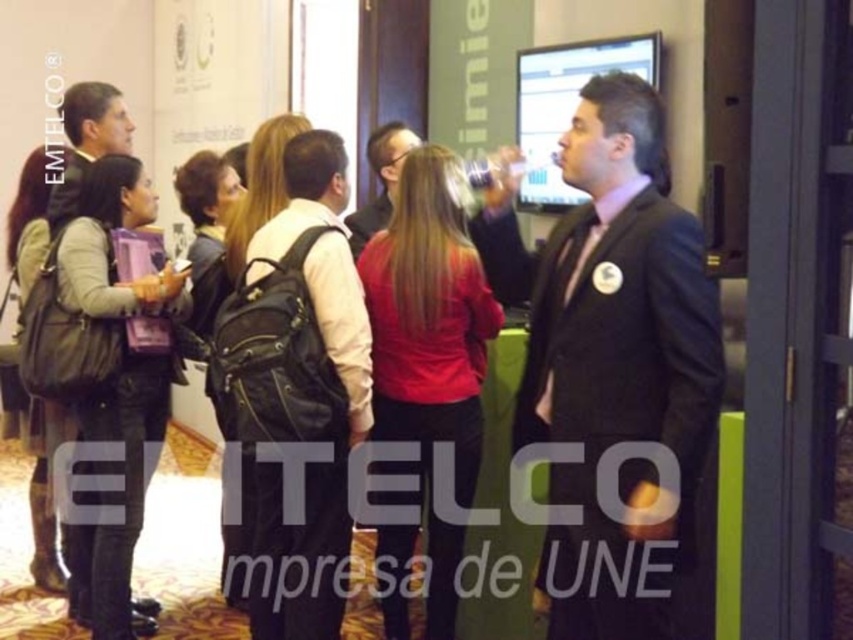
You are an attendee at this event and need to locate the speaker who is wearing a black suit at center. From your perspective, where would you look relative to the red matte jacket at center?

The black suit at center is located above the red matte jacket at center, so you should look upwards from the red matte jacket at center to find the speaker wearing the black suit at center.

You are navigating through the event space and need to reach a specific location marked by point coordinates. You are currently at point coordinates point (412, 396). There is another point at (569, 404). Which point is closer to your current position?

Point (412, 396) is your current position, so it is naturally the closest to you. The other point at (569, 404) is farther away.